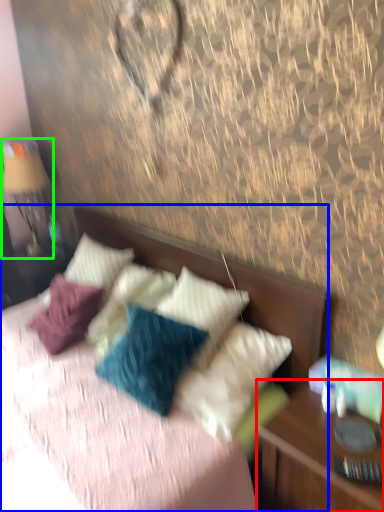
Question: Which is farther away from nightstand (highlighted by a red box)? bed (highlighted by a blue box) or bedside lamp (highlighted by a green box)?

Choices:
 (A) bed
 (B) bedside lamp

Answer: (B)